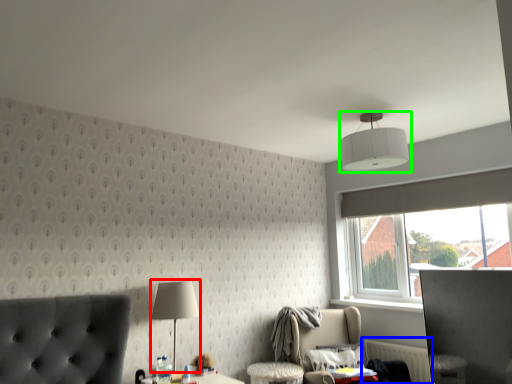
Question: Which object is the closest to the table lamp (highlighted by a red box)? Choose among these: radiator (highlighted by a blue box) or lamp (highlighted by a green box).

Choices:
 (A) radiator
 (B) lamp

Answer: (B)